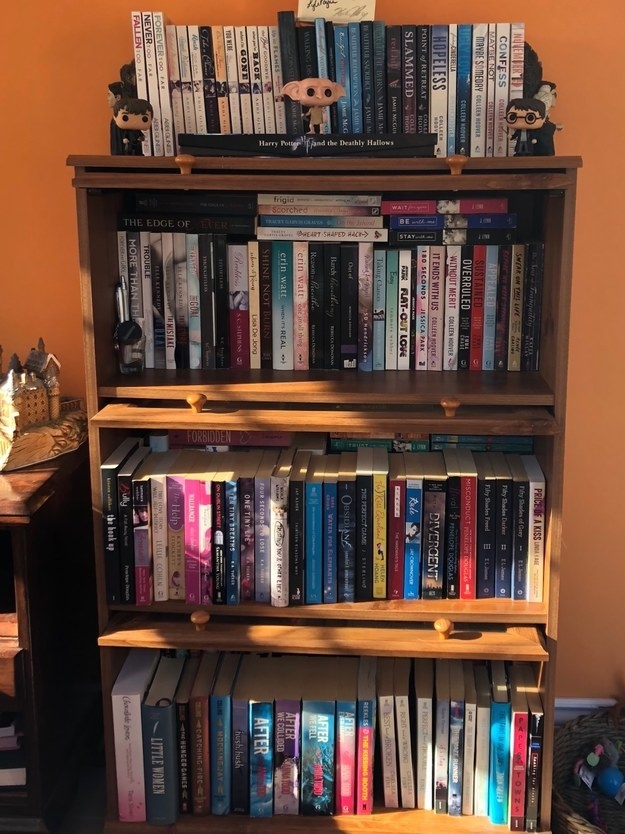
This screenshot has width=625, height=834. What are the coordinates of `basket` in the screenshot? It's located at (567, 801).